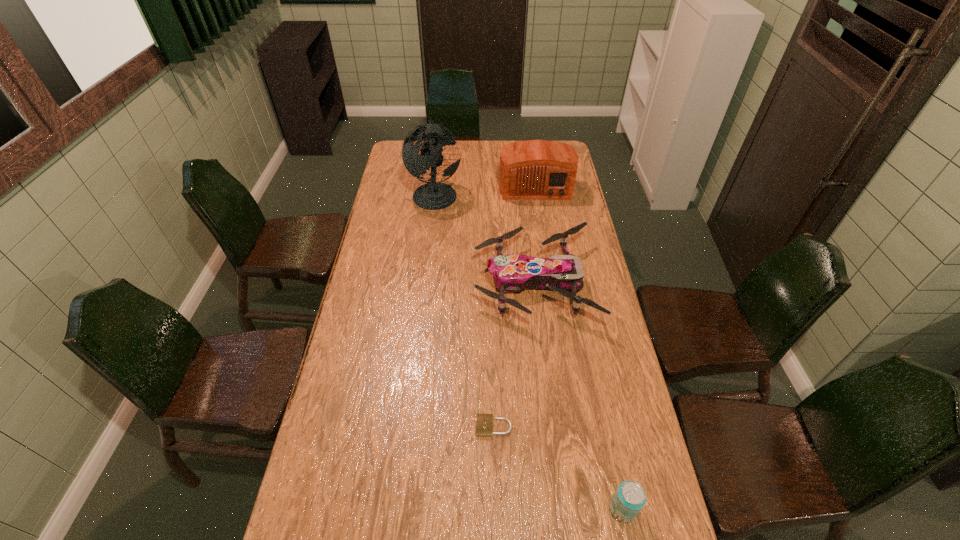
This screenshot has width=960, height=540. I want to click on free point between the radio receiver and the globe, so click(485, 190).

Find the location of a particular element. vacant area between the shortest object and the third farthest object is located at coordinates (514, 355).

Locate an element on the screen. The image size is (960, 540). object that is the closest one to the fourth shortest object is located at coordinates (434, 195).

Identify which object is located as the fourth nearest to the nearest object. Please provide its 2D coordinates. Your answer should be formatted as a tuple, i.e. [(x, y)], where the tuple contains the x and y coordinates of a point satisfying the conditions above.

[(434, 195)]

The width and height of the screenshot is (960, 540). Identify the location of vacant space that satisfies the following two spatial constraints: 1. on the front-facing side of the nearest object; 2. on the right side of the radio receiver. (584, 509).

Identify the location of free location that satisfies the following two spatial constraints: 1. on the front-facing side of the radio receiver; 2. on the front-facing side of the globe. The height and width of the screenshot is (540, 960). (537, 193).

Locate an element on the screen. vacant position in the image that satisfies the following two spatial constraints: 1. on the front-facing side of the radio receiver; 2. on the front-facing side of the leftmost object is located at coordinates (537, 193).

Find the location of `free space that satisfies the following two spatial constraints: 1. on the front-facing side of the drone; 2. on the front side of the fourth farthest object`. free space that satisfies the following two spatial constraints: 1. on the front-facing side of the drone; 2. on the front side of the fourth farthest object is located at coordinates (550, 426).

The width and height of the screenshot is (960, 540). I want to click on vacant space that satisfies the following two spatial constraints: 1. on the front-facing side of the second tallest object; 2. on the left side of the nearest object, so click(x=584, y=509).

In order to click on vacant area in the image that satisfies the following two spatial constraints: 1. on the front-facing side of the fourth shortest object; 2. on the left side of the beer can in this screenshot , I will do `click(584, 509)`.